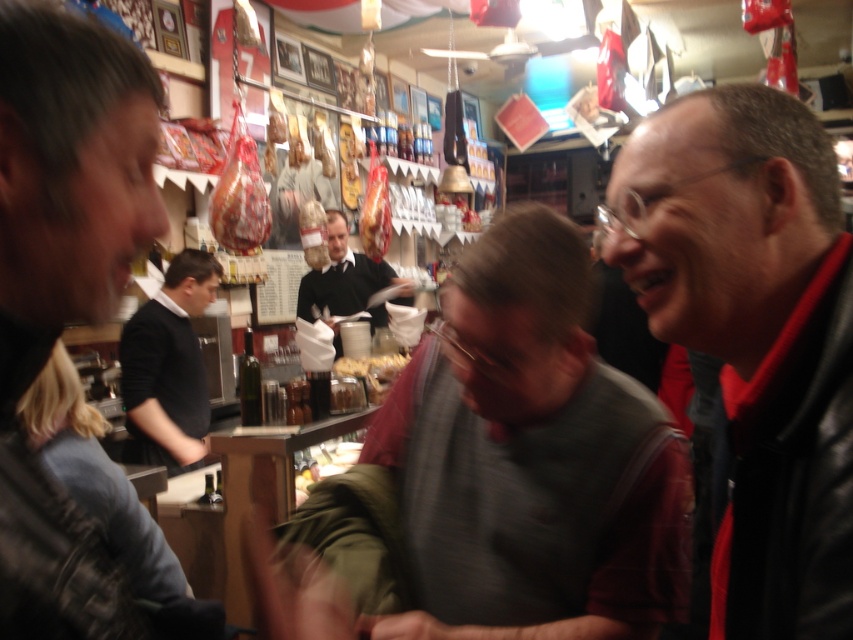
From the picture: What object is located at the coordinate point (531, 458) in the image?

The gray zippered jacket at center is located at the coordinate point (531, 458) in the image.

In the scene shown: You are a store employee who needs to hang a sign above the two jackets displayed at the center. The sign must be placed exactly between them. Given that the gray zippered jacket at center is smaller than the black leather jacket at center, which jacket should the sign be closer to?

The sign should be placed closer to the gray zippered jacket at center because it is smaller than the black leather jacket at center, ensuring equal visual balance between both items.